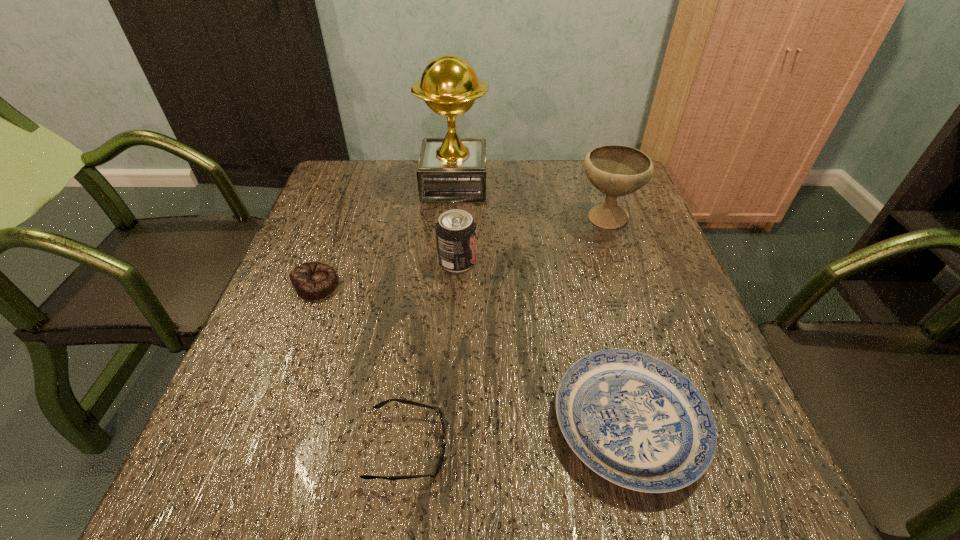
Identify the location of object that is at the near right corner. This screenshot has width=960, height=540. (635, 420).

This screenshot has width=960, height=540. Find the location of `vacant area at the far edge`. vacant area at the far edge is located at coordinates (403, 195).

The height and width of the screenshot is (540, 960). I want to click on blank space at the near edge of the desktop, so click(533, 468).

Locate an element on the screen. vacant space at the left edge is located at coordinates (251, 407).

Image resolution: width=960 pixels, height=540 pixels. I want to click on vacant area at the right edge of the desktop, so click(698, 376).

The height and width of the screenshot is (540, 960). What are the coordinates of `vacant space at the far left corner of the desktop` in the screenshot? It's located at coord(352,180).

Image resolution: width=960 pixels, height=540 pixels. Identify the location of vacant area at the far right corner of the desktop. (578, 172).

Find the location of a particular element. This screenshot has height=540, width=960. free point between the plate and the beanbag is located at coordinates (473, 354).

I want to click on vacant point located between the sunglasses and the plate, so click(x=518, y=435).

Identify the location of vacant area that lies between the third tallest object and the plate. (543, 342).